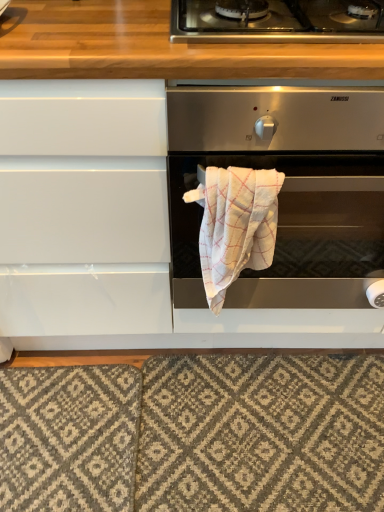
Question: From a real-world perspective, is textured gray rug at lower center below stainless steel gas stove at upper center?

Choices:
 (A) no
 (B) yes

Answer: (B)

Question: From the image's perspective, is textured gray rug at lower center below stainless steel gas stove at upper center?

Choices:
 (A) no
 (B) yes

Answer: (B)

Question: Is textured gray rug at lower center taller than stainless steel gas stove at upper center?

Choices:
 (A) yes
 (B) no

Answer: (B)

Question: Is stainless steel gas stove at upper center located within textured gray rug at lower center?

Choices:
 (A) no
 (B) yes

Answer: (A)

Question: Is textured gray rug at lower center positioned with its back to stainless steel gas stove at upper center?

Choices:
 (A) no
 (B) yes

Answer: (A)

Question: Is textured gray rug at lower center in front of or behind satin silver oven at center in the image?

Choices:
 (A) front
 (B) behind

Answer: (B)

Question: Based on their positions, is textured gray rug at lower center located to the left or right of satin silver oven at center?

Choices:
 (A) right
 (B) left

Answer: (B)

Question: Is point (226, 441) positioned closer to the camera than point (370, 208)?

Choices:
 (A) closer
 (B) farther

Answer: (B)

Question: Is textured gray rug at lower center wider or thinner than satin silver oven at center?

Choices:
 (A) wide
 (B) thin

Answer: (B)

Question: From their relative heights in the image, would you say textured gray rug at lower center is taller or shorter than stainless steel gas stove at upper center?

Choices:
 (A) tall
 (B) short

Answer: (B)

Question: Which is correct: textured gray rug at lower center is inside stainless steel gas stove at upper center, or outside of it?

Choices:
 (A) outside
 (B) inside

Answer: (A)

Question: Considering the positions of textured gray rug at lower center and stainless steel gas stove at upper center in the image, is textured gray rug at lower center wider or thinner than stainless steel gas stove at upper center?

Choices:
 (A) thin
 (B) wide

Answer: (B)

Question: From a real-world perspective, is textured gray rug at lower center positioned above or below stainless steel gas stove at upper center?

Choices:
 (A) above
 (B) below

Answer: (B)

Question: Considering the positions of satin silver oven at center and textured gray rug at lower center in the image, is satin silver oven at center taller or shorter than textured gray rug at lower center?

Choices:
 (A) tall
 (B) short

Answer: (A)

Question: Considering the positions of satin silver oven at center and textured gray rug at lower center in the image, is satin silver oven at center bigger or smaller than textured gray rug at lower center?

Choices:
 (A) big
 (B) small

Answer: (A)